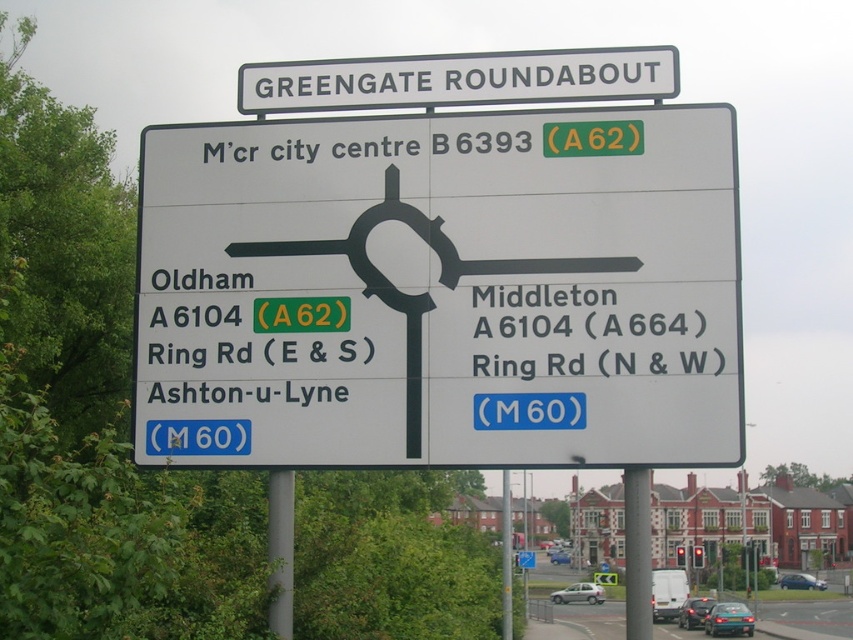
You are a driver approaching the Greengate Roundabout and need to read both the white plastic sign at center and the black text on white sign at right. Which one is located to the left of the other?

The white plastic sign at center is positioned on the left side of black text on white sign at right.